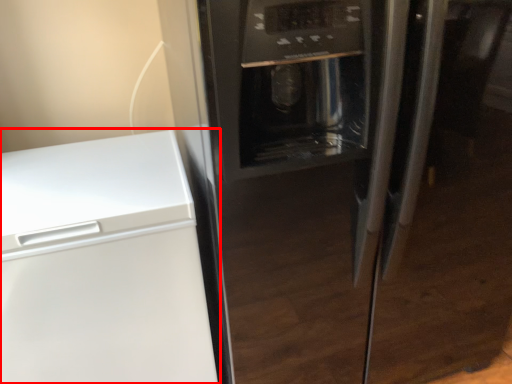
Question: From the image's perspective, what is the correct spatial relationship of home appliance (annotated by the red box) in relation to refrigerator?

Choices:
 (A) below
 (B) above

Answer: (A)